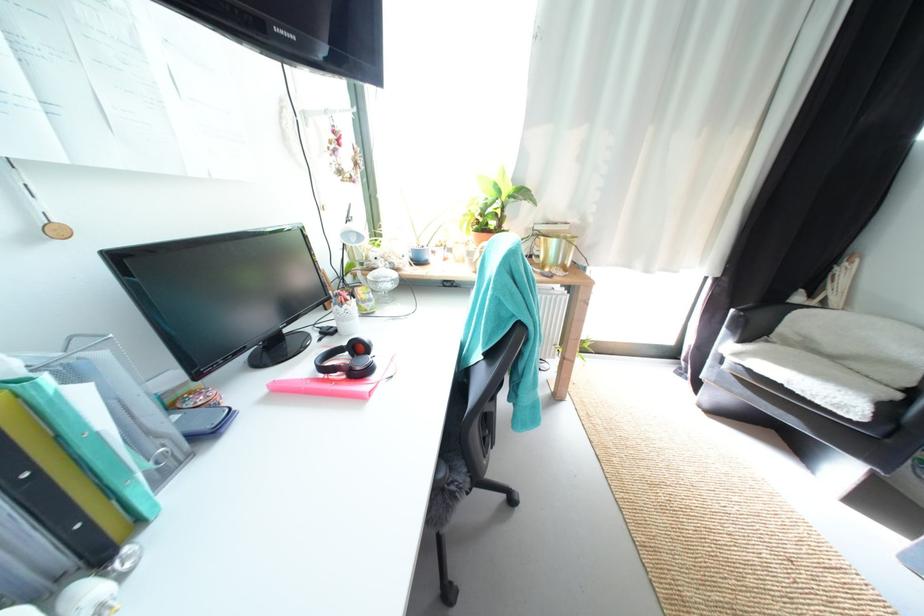
Locate an element on the screen. yellow binder hole is located at coordinates (28, 431).